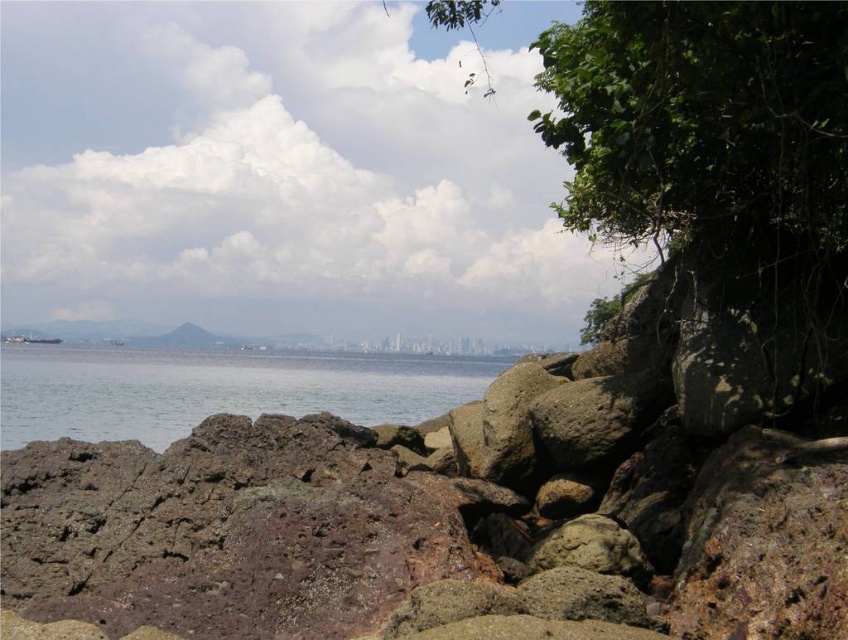
This screenshot has height=640, width=848. Describe the element at coordinates (481, 497) in the screenshot. I see `brown rough rocks at center` at that location.

Who is lower down, brown rough rocks at center or clear water at center?

Positioned lower is clear water at center.

Locate an element on the screen. The height and width of the screenshot is (640, 848). brown rough rocks at center is located at coordinates (481, 497).